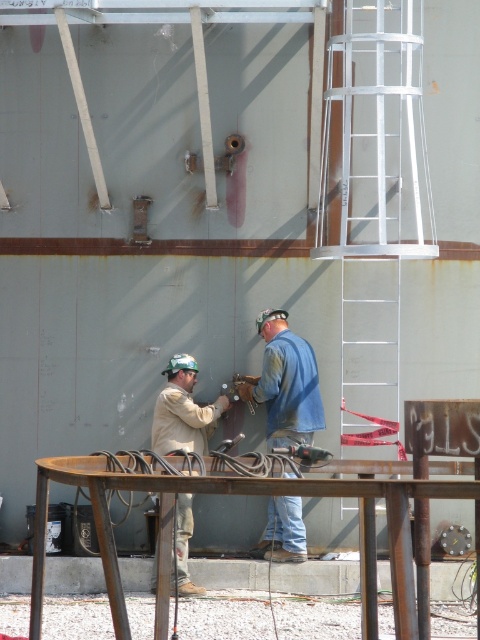
Can you confirm if white metallic ladder at center right is positioned below blue denim jacket at center?

No.

Who is lower down, white metallic ladder at center right or blue denim jacket at center?

blue denim jacket at center is lower down.

Identify the location of white metallic ladder at center right. (372, 192).

Is white metallic ladder at center right further to the viewer compared to tan fabric shirt at center?

No.

Which of these two, white metallic ladder at center right or tan fabric shirt at center, stands taller?

Standing taller between the two is white metallic ladder at center right.

Who is more forward, [333,48] or [181,385]?

Positioned in front is point [333,48].

The height and width of the screenshot is (640, 480). What are the coordinates of `white metallic ladder at center right` in the screenshot? It's located at tap(372, 192).

Which is above, blue denim jacket at center or tan fabric shirt at center?

blue denim jacket at center is higher up.

Is point (255, 554) behind point (164, 372)?

No, it is not.

Locate an element on the screen. blue denim jacket at center is located at coordinates (285, 384).